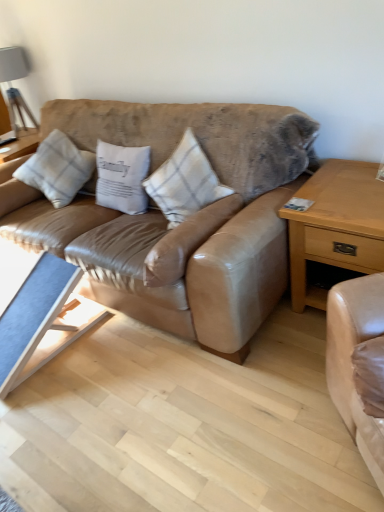
The width and height of the screenshot is (384, 512). What are the coordinates of `vacant space to the right of blue fabric coffee table at lower left` in the screenshot? It's located at (118, 353).